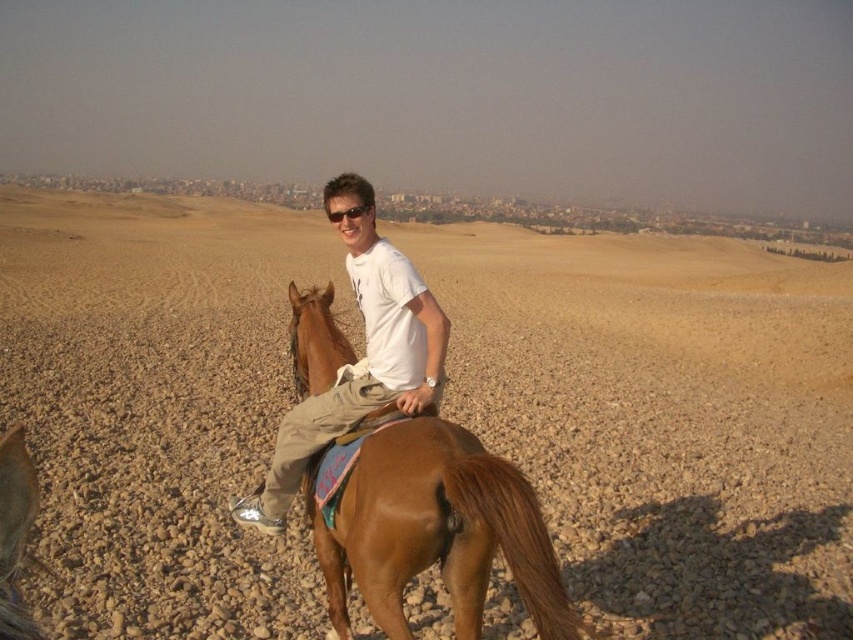
Does point (358, 237) come in front of point (360, 202)?

No, (358, 237) is behind (360, 202).

Is point (257, 524) closer to camera compared to point (352, 214)?

No, (257, 524) is further to viewer.

Locate an element on the screen. This screenshot has height=640, width=853. matte white shirt at center is located at coordinates (358, 368).

Is point (200, 244) less distant than point (355, 212)?

No, it is behind (355, 212).

Is brown gravelly dirt field at center taller than black plastic sunglasses at center?

Correct, brown gravelly dirt field at center is much taller as black plastic sunglasses at center.

The width and height of the screenshot is (853, 640). I want to click on brown gravelly dirt field at center, so click(663, 419).

Is brown glossy horse at center to the left of black plastic sunglasses at center from the viewer's perspective?

In fact, brown glossy horse at center is to the right of black plastic sunglasses at center.

Is point (537, 628) more distant than point (332, 216)?

No.

Locate an element on the screen. This screenshot has width=853, height=640. brown glossy horse at center is located at coordinates (434, 529).